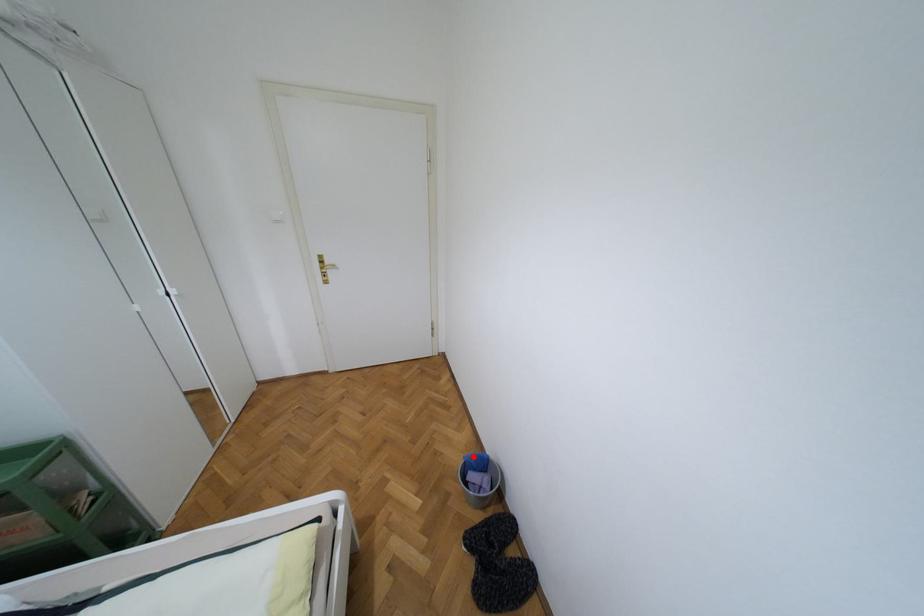
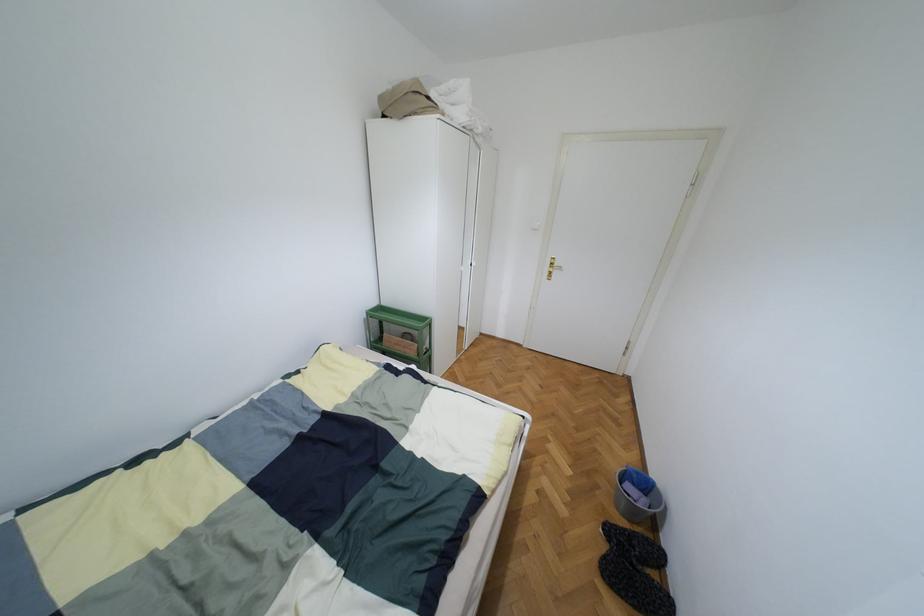
Question: I am providing you with two images of the same scene from different viewpoints. A red point is shown in image1. For the corresponding object point in image2, is it positioned nearer or farther from the camera?

Choices:
 (A) Nearer
 (B) Farther

Answer: (B)